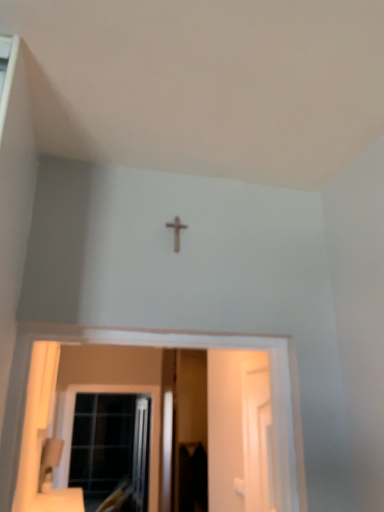
Question: Is wooden cross at center to the left or to the right of white glossy screen door at right, the second screen door positioned from the left, in the image?

Choices:
 (A) left
 (B) right

Answer: (A)

Question: Looking at their shapes, would you say wooden cross at center is wider or thinner than white glossy screen door at right, acting as the first screen door starting from the front?

Choices:
 (A) wide
 (B) thin

Answer: (A)

Question: Which of these objects is positioned closest to the white glossy screen door at right, acting as the first screen door starting from the front?

Choices:
 (A) transparent plastic screen door at center, which appears as the 1th screen door when viewed from the back
 (B) wooden cross at center
 (C) clear glass window at lower left

Answer: (B)

Question: Estimate the real-world distances between objects in this image. Which object is closer to the transparent plastic screen door at center, which ranks as the second screen door in right-to-left order?

Choices:
 (A) white glossy screen door at right, acting as the first screen door starting from the front
 (B) clear glass window at lower left
 (C) wooden cross at center

Answer: (B)